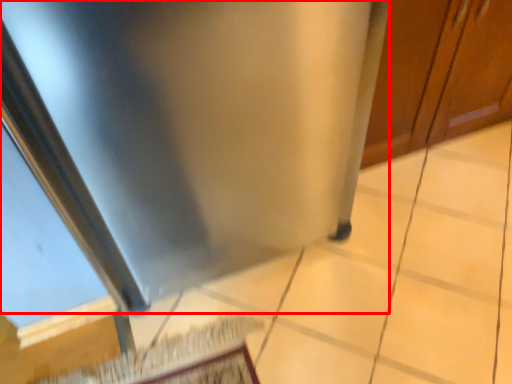
Question: From the image's perspective, what is the correct spatial relationship of stainless steel (annotated by the red box) in relation to door?

Choices:
 (A) above
 (B) below

Answer: (B)